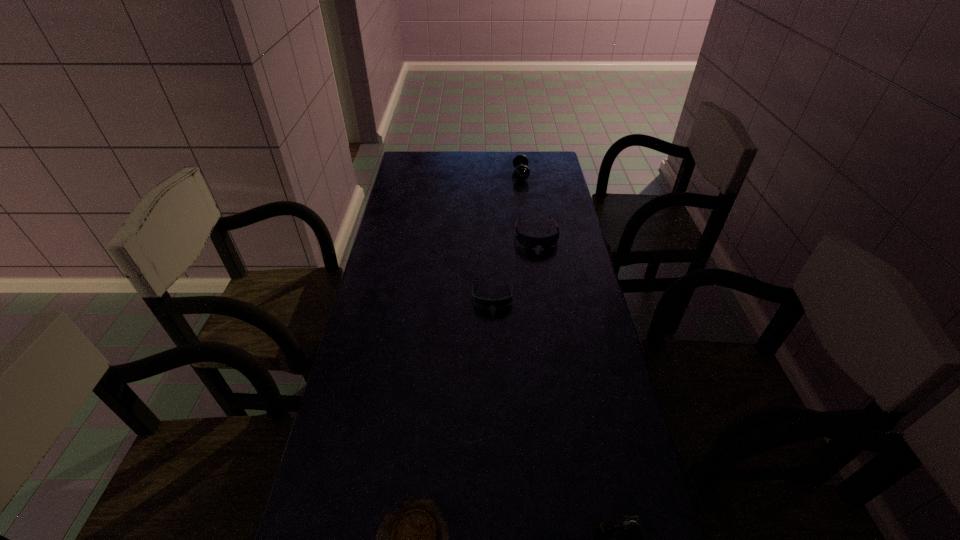
Find the location of `dumbbell that is at the right edge`. dumbbell that is at the right edge is located at coordinates [x=521, y=172].

At what (x,y) coordinates should I click in order to perform the action: click on goggles that is at the right edge. Please return your answer as a coordinate pair (x, y). This screenshot has height=540, width=960. Looking at the image, I should click on (530, 242).

This screenshot has width=960, height=540. What are the coordinates of `object that is at the far right corner` in the screenshot? It's located at (521, 172).

In the image, there is a desktop. Identify the location of vacant region at the far edge. (442, 169).

The width and height of the screenshot is (960, 540). What are the coordinates of `vacant space at the left edge of the desktop` in the screenshot? It's located at (400, 387).

Find the location of a particular element. The height and width of the screenshot is (540, 960). vacant area at the right edge of the desktop is located at coordinates (557, 354).

The width and height of the screenshot is (960, 540). I want to click on free space at the far right corner of the desktop, so click(x=550, y=154).

Where is `vacant point located between the fourth shortest object and the farthest object`? The image size is (960, 540). vacant point located between the fourth shortest object and the farthest object is located at coordinates (x=528, y=205).

Where is `unoccupied position between the leftmost goggles and the tallest goggles`? Image resolution: width=960 pixels, height=540 pixels. unoccupied position between the leftmost goggles and the tallest goggles is located at coordinates (515, 266).

Point out which object is positioned as the nearest to the dumbbell. Please provide its 2D coordinates. Your answer should be formatted as a tuple, i.e. [(x, y)], where the tuple contains the x and y coordinates of a point satisfying the conditions above.

[(530, 242)]